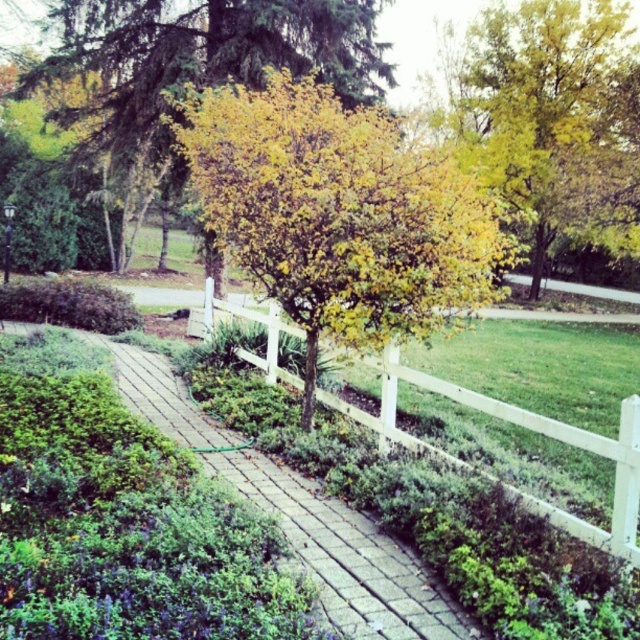
Between yellow-green leaves at upper right and brick paved path at center, which one appears on the left side from the viewer's perspective?

brick paved path at center

Is yellow-green leaves at upper right wider than brick paved path at center?

Yes, yellow-green leaves at upper right is wider than brick paved path at center.

Between point (508, 193) and point (451, 637), which one is positioned behind?

Point (508, 193)

The height and width of the screenshot is (640, 640). In order to click on yellow-green leaves at upper right in this screenshot , I will do tap(538, 104).

Between yellow-green foliage at upper center and yellow-green leaves at upper right, which one appears on the right side from the viewer's perspective?

yellow-green leaves at upper right

Does yellow-green foliage at upper center appear on the left side of yellow-green leaves at upper right?

Correct, you'll find yellow-green foliage at upper center to the left of yellow-green leaves at upper right.

Is point (134, 74) farther from viewer compared to point (577, 195)?

No, it is not.

Where is `yellow-green foliage at upper center`? yellow-green foliage at upper center is located at coordinates (202, 56).

Is yellow-green foliage at center wider than brick paved path at center?

Yes, yellow-green foliage at center is wider than brick paved path at center.

Does yellow-green foliage at center appear on the right side of brick paved path at center?

Incorrect, yellow-green foliage at center is not on the right side of brick paved path at center.

Between point (340, 186) and point (193, 436), which one is positioned in front?

Point (340, 186) is in front.

This screenshot has width=640, height=640. Find the location of `yellow-green foliage at center`. yellow-green foliage at center is located at coordinates (339, 214).